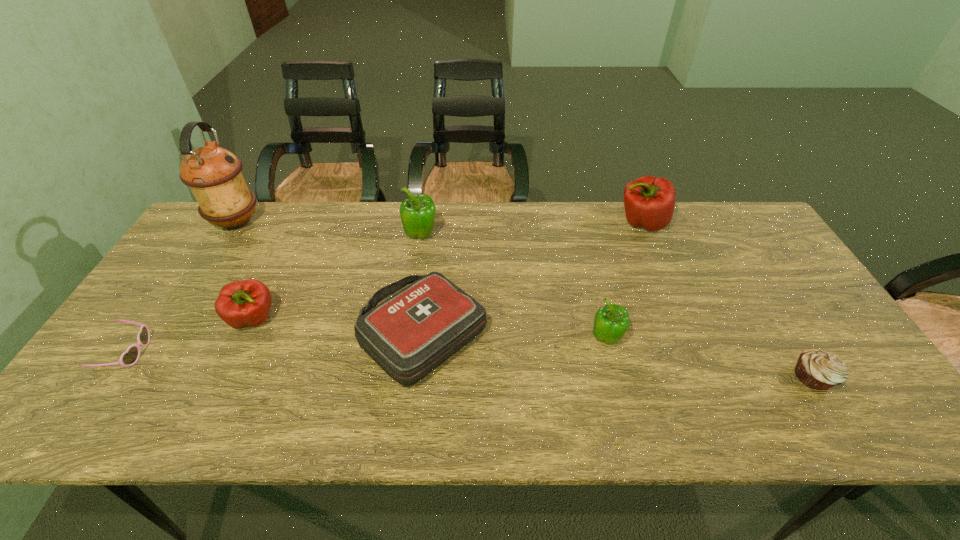
This screenshot has height=540, width=960. Identify the location of oil lamp. (213, 174).

You are a GUI agent. You are given a task and a screenshot of the screen. Output one action in this format:
    pyautogui.click(x=<x>, y=<y>)
    Task: Click on the left green bell pepper
    The height and width of the screenshot is (540, 960).
    Given the screenshot: What is the action you would take?
    pyautogui.click(x=417, y=212)

Locate an element on the screen. The image size is (960, 540). the third bell pepper from right to left is located at coordinates (417, 212).

Locate an element on the screen. This screenshot has height=540, width=960. the rightmost bell pepper is located at coordinates (649, 202).

Locate an element on the screen. This screenshot has height=540, width=960. the second object from right to left is located at coordinates (649, 202).

Locate an element on the screen. The height and width of the screenshot is (540, 960). the right green bell pepper is located at coordinates (611, 322).

The width and height of the screenshot is (960, 540). I want to click on the sixth object from left to right, so click(611, 322).

The width and height of the screenshot is (960, 540). Find the location of `the smaller pink bell pepper`. the smaller pink bell pepper is located at coordinates (244, 303).

This screenshot has height=540, width=960. I want to click on the left pink bell pepper, so click(244, 303).

Find the location of a particular element. This screenshot has height=540, width=960. the first-aid kit is located at coordinates (409, 335).